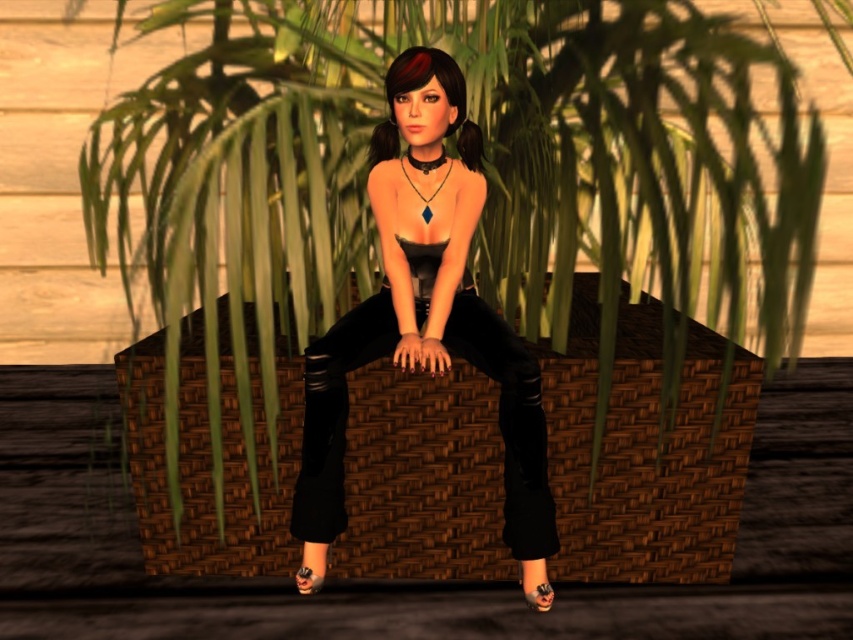
Between point (341, 420) and point (527, 577), which one is positioned in front?

Positioned in front is point (341, 420).

Between matte black pants at center and black leather sandal at lower center, which one has more height?

With more height is matte black pants at center.

Who is more forward, (471,131) or (532,605)?

Point (532,605) is more forward.

The width and height of the screenshot is (853, 640). In order to click on matte black pants at center in this screenshot , I will do `click(422, 314)`.